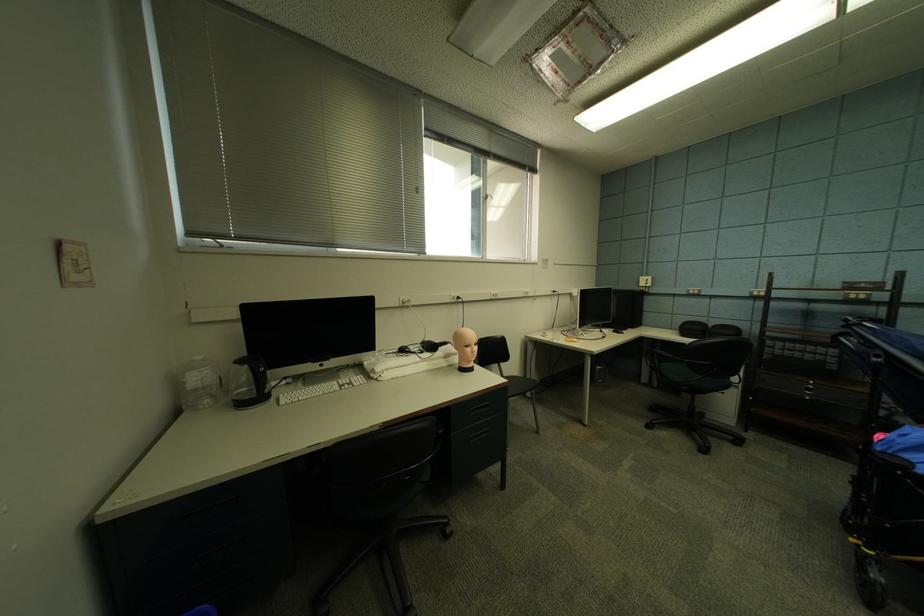
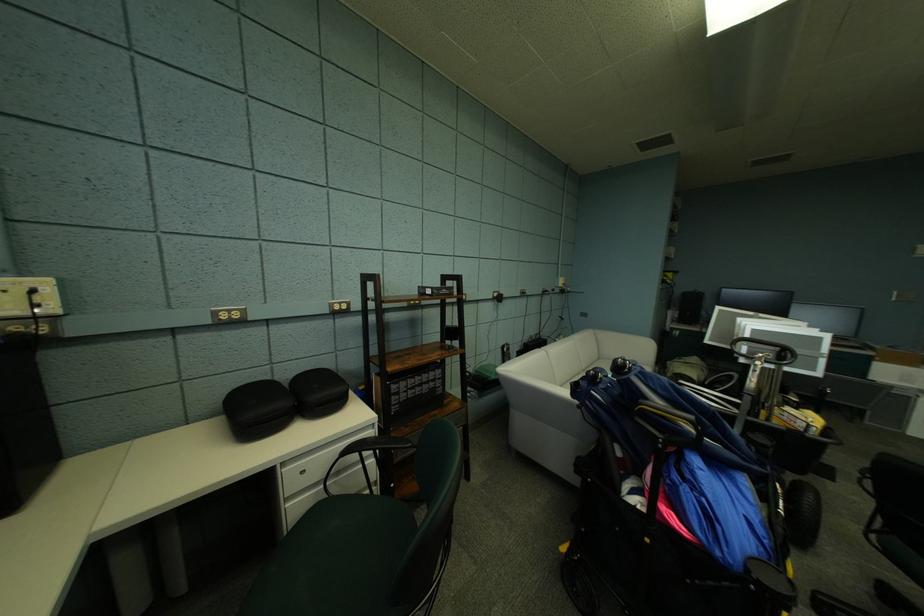
In the second image, find the point that corresponds to point 719,330 in the first image.

(297, 389)